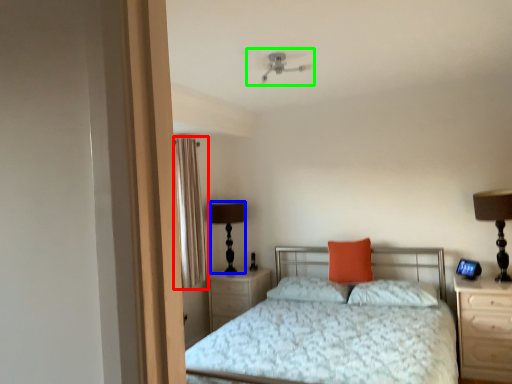
Question: Which object is positioned closest to curtain (highlighted by a red box)? Select from table lamp (highlighted by a blue box) and mechanical fan (highlighted by a green box).

Choices:
 (A) table lamp
 (B) mechanical fan

Answer: (A)